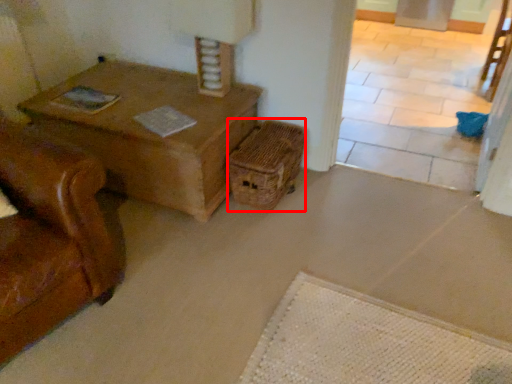
Question: Observing the image, what is the correct spatial positioning of crate (annotated by the red box) in reference to chair?

Choices:
 (A) right
 (B) left

Answer: (B)